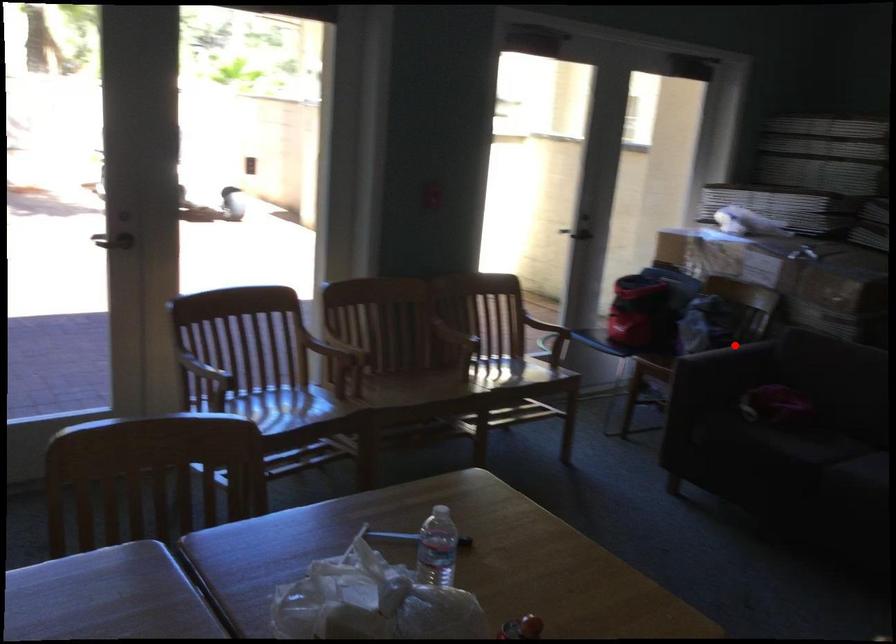
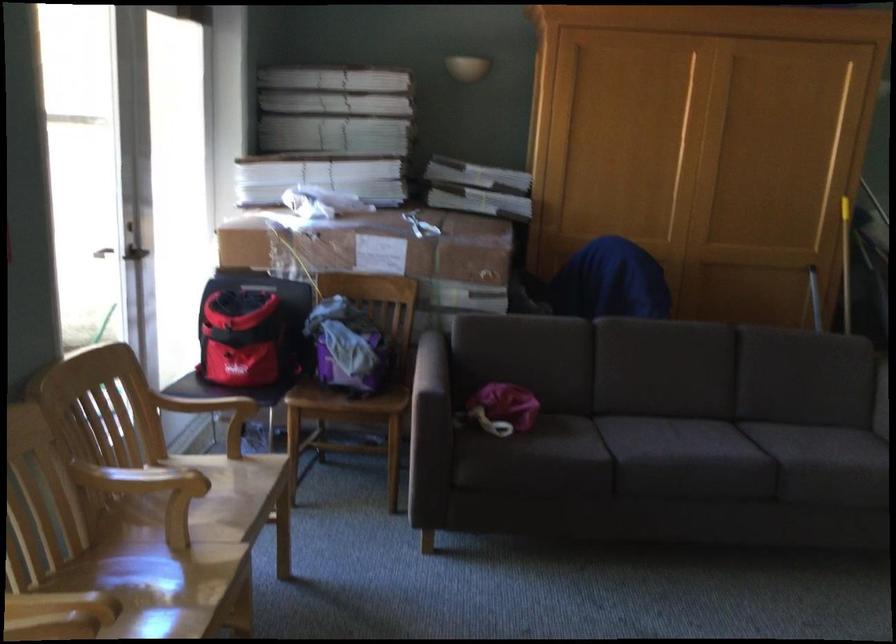
Locate, in the second image, the point that corresponds to the highlighted location in the first image.

(431, 365)